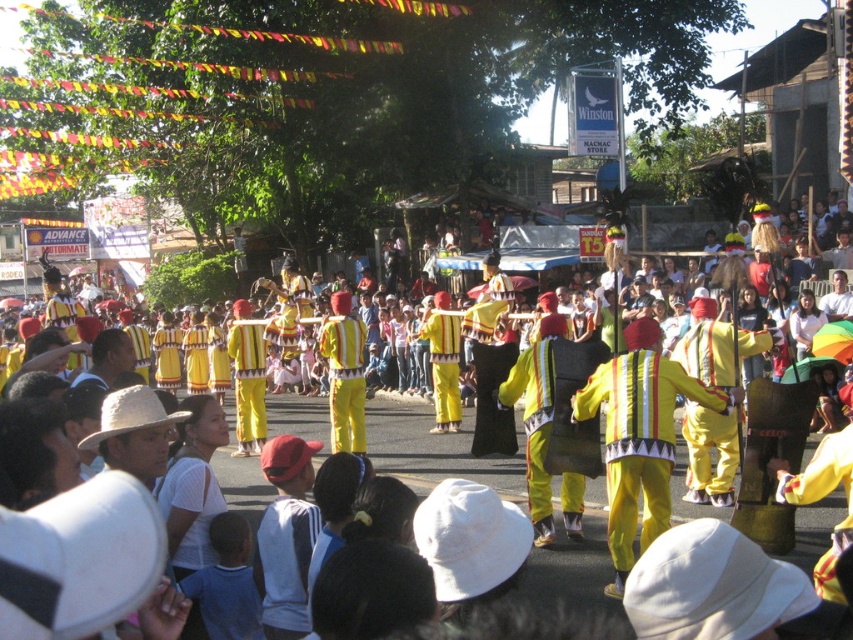
In the scene shown: Does yellow fabric costumes at center appear on the left side of yellow fabric costume at center?

Correct, you'll find yellow fabric costumes at center to the left of yellow fabric costume at center.

Is yellow fabric costumes at center shorter than yellow fabric costume at center?

No, yellow fabric costumes at center is not shorter than yellow fabric costume at center.

Does point (495, 484) come behind point (692, 368)?

Yes, it is behind point (692, 368).

Find the location of `yellow fabric costumes at center`. yellow fabric costumes at center is located at coordinates (434, 449).